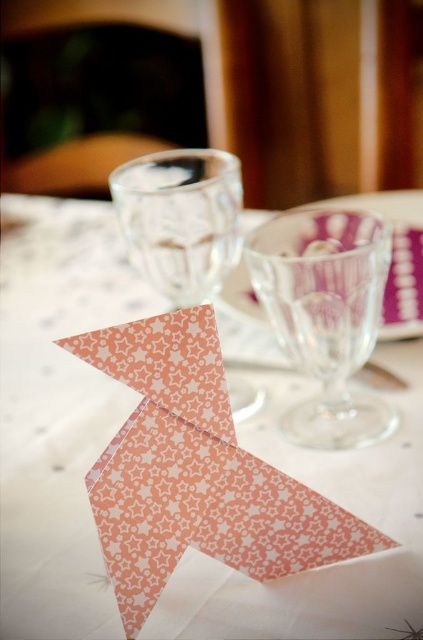
In the scene shown: Which is above, pink paper origami at center or transparent glass wine glass at center?

pink paper origami at center is above.

In the scene shown: Can you confirm if pink paper origami at center is positioned below transparent glass wine glass at center?

No.

Image resolution: width=423 pixels, height=640 pixels. What do you see at coordinates (57, 412) in the screenshot?
I see `pink paper origami at center` at bounding box center [57, 412].

You are a GUI agent. You are given a task and a screenshot of the screen. Output one action in this format:
    pyautogui.click(x=<x>, y=<y>)
    Task: Click on the pink paper origami at center
    Image resolution: width=423 pixels, height=640 pixels.
    Given the screenshot: What is the action you would take?
    pyautogui.click(x=57, y=412)

Does pink paper origami at center have a lesser height compared to clear glass wine glass at center?

No, pink paper origami at center is not shorter than clear glass wine glass at center.

Which of these two, pink paper origami at center or clear glass wine glass at center, stands shorter?

With less height is clear glass wine glass at center.

Image resolution: width=423 pixels, height=640 pixels. What are the coordinates of `pink paper origami at center` in the screenshot? It's located at (57, 412).

Does clear glass wine glass at center have a greater height compared to transparent glass wine glass at center?

Incorrect, clear glass wine glass at center's height is not larger of transparent glass wine glass at center's.

Where is `clear glass wine glass at center`? The image size is (423, 640). clear glass wine glass at center is located at coordinates (326, 316).